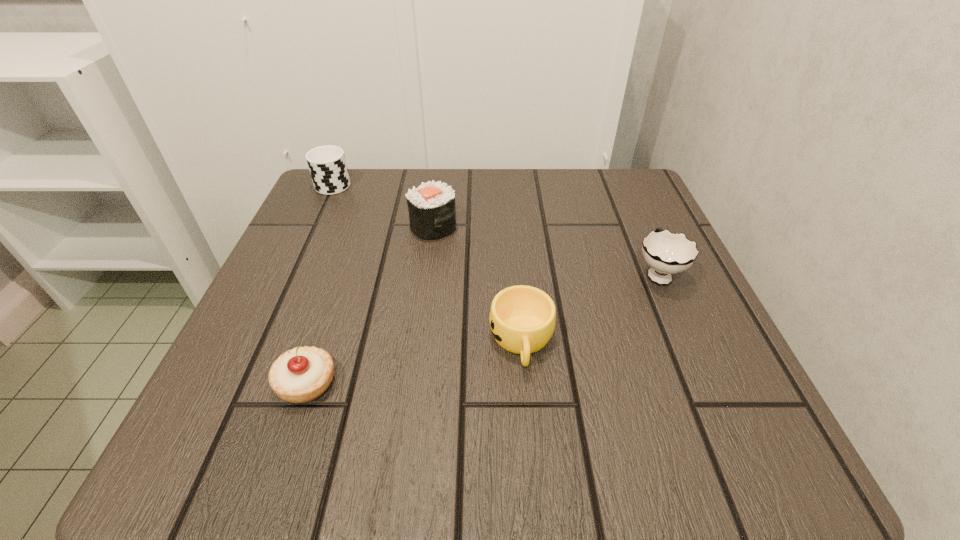
The width and height of the screenshot is (960, 540). What are the coordinates of `free point located on the side of the rightmost object with the handle` in the screenshot? It's located at (637, 227).

Locate an element on the screen. Image resolution: width=960 pixels, height=540 pixels. free point located on the side of the rightmost object with the handle is located at coordinates tap(615, 176).

Find the location of a particular element. The width and height of the screenshot is (960, 540). vacant space located on the side of the rightmost object with the handle is located at coordinates (619, 185).

This screenshot has width=960, height=540. Identify the location of free space located 0.070m on the right of the pastry. (386, 383).

I want to click on free space located 0.170m on the left of the second object from right to left, so click(377, 341).

The height and width of the screenshot is (540, 960). Identify the location of sushi that is at the far edge. (432, 214).

You are a GUI agent. You are given a task and a screenshot of the screen. Output one action in this format:
    pyautogui.click(x=<x>, y=<y>)
    Task: Click on the cup present at the far edge
    Image resolution: width=960 pixels, height=540 pixels.
    Given the screenshot: What is the action you would take?
    pyautogui.click(x=327, y=165)

Identify the location of object present at the near edge. The width and height of the screenshot is (960, 540). (302, 374).

The height and width of the screenshot is (540, 960). I want to click on cup positioned at the left edge, so click(327, 165).

Where is `pastry that is at the left edge`? The height and width of the screenshot is (540, 960). pastry that is at the left edge is located at coordinates (302, 374).